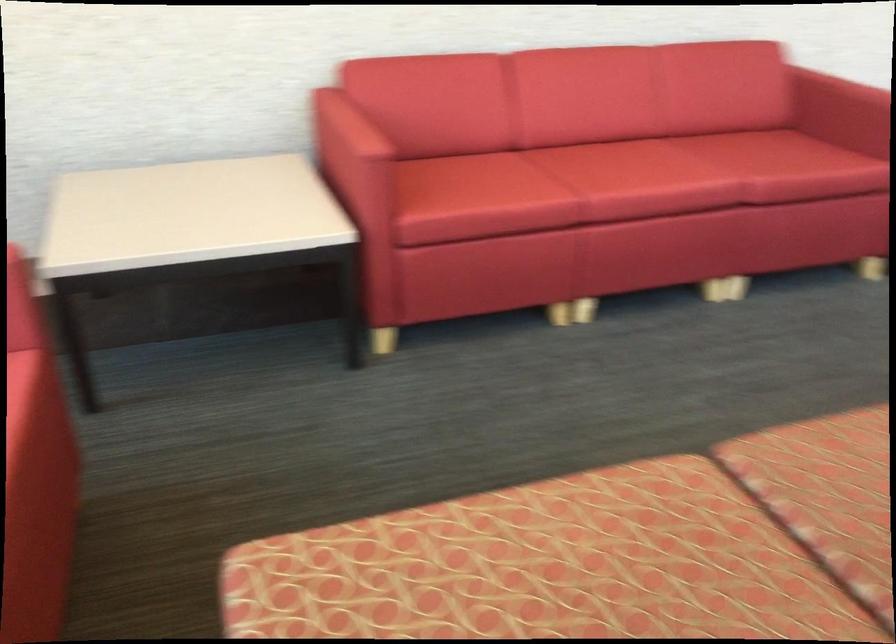
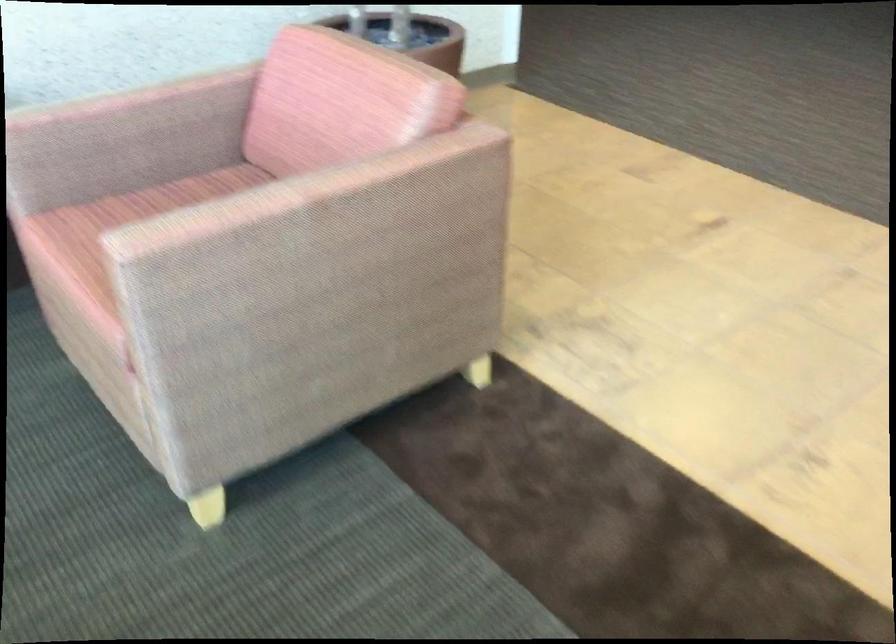
Question: Which direction would the cameraman need to move to produce the second image? Reply with the corresponding letter.

Choices:
 (A) Left
 (B) Right
 (C) Forward
 (D) Backward

Answer: (B)